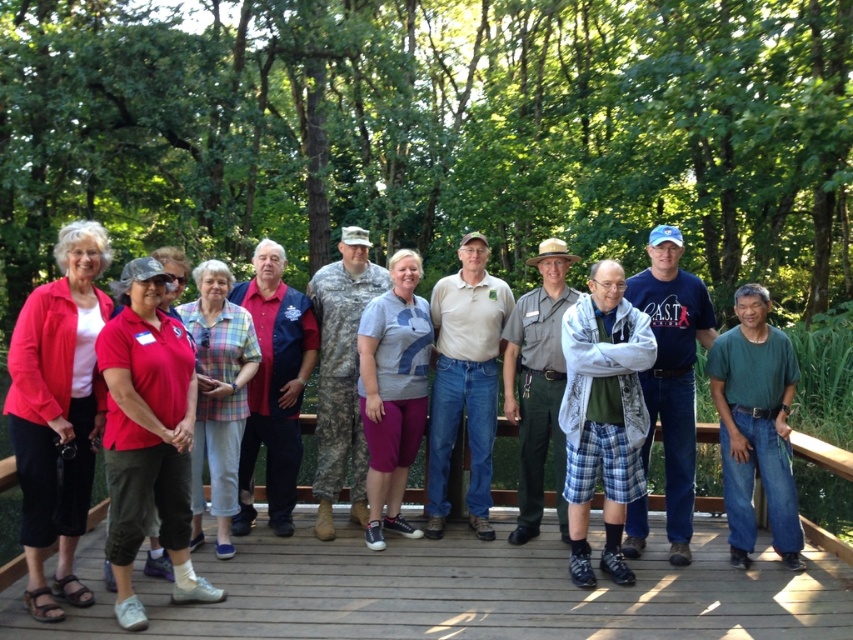
What are the coordinates of the plaid cotton shorts at center?

The plaid cotton shorts at center is located at point (602, 413).